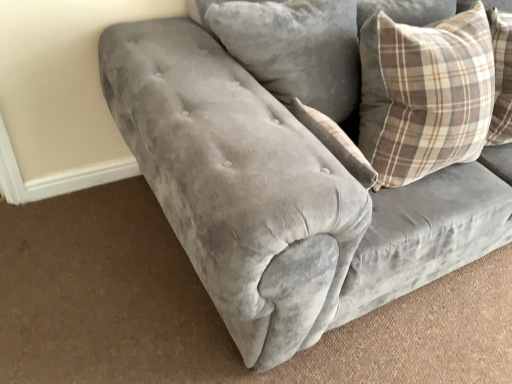
Question: Should I look upward or downward to see plaid fabric pillow at upper right, arranged as the 2th pillow when viewed from the right?

Choices:
 (A) down
 (B) up

Answer: (B)

Question: Is plaid fabric pillow at upper right, arranged as the 2th pillow when viewed from the right, located within plaid fabric pillow at upper right, the 1th pillow from the right?

Choices:
 (A) no
 (B) yes

Answer: (A)

Question: Is plaid fabric pillow at upper right, the 1th pillow from the right, shorter than plaid fabric pillow at upper right, arranged as the 2th pillow when viewed from the right?

Choices:
 (A) no
 (B) yes

Answer: (B)

Question: Does plaid fabric pillow at upper right, the 1th pillow from the right, come behind plaid fabric pillow at upper right, arranged as the 2th pillow when viewed from the right?

Choices:
 (A) yes
 (B) no

Answer: (B)

Question: From a real-world perspective, is plaid fabric pillow at upper right, which appears as the second pillow when viewed from the left, positioned over plaid fabric pillow at upper right, placed as the first pillow when sorted from left to right, based on gravity?

Choices:
 (A) no
 (B) yes

Answer: (A)

Question: Considering the relative sizes of plaid fabric pillow at upper right, which appears as the second pillow when viewed from the left, and plaid fabric pillow at upper right, placed as the first pillow when sorted from left to right, in the image provided, is plaid fabric pillow at upper right, which appears as the second pillow when viewed from the left, wider than plaid fabric pillow at upper right, placed as the first pillow when sorted from left to right,?

Choices:
 (A) no
 (B) yes

Answer: (A)

Question: Does plaid fabric pillow at upper right, the 1th pillow from the right, have a greater height compared to plaid fabric pillow at upper right, arranged as the 2th pillow when viewed from the right?

Choices:
 (A) yes
 (B) no

Answer: (B)

Question: Does plaid fabric pillow at upper right, placed as the first pillow when sorted from left to right, have a smaller size compared to plaid fabric pillow at upper right, the 1th pillow from the right?

Choices:
 (A) yes
 (B) no

Answer: (B)

Question: Is plaid fabric pillow at upper right, placed as the first pillow when sorted from left to right, bigger than plaid fabric pillow at upper right, which appears as the second pillow when viewed from the left?

Choices:
 (A) yes
 (B) no

Answer: (A)

Question: Considering the relative positions of plaid fabric pillow at upper right, placed as the first pillow when sorted from left to right, and plaid fabric pillow at upper right, which appears as the second pillow when viewed from the left, in the image provided, is plaid fabric pillow at upper right, placed as the first pillow when sorted from left to right, in front of plaid fabric pillow at upper right, which appears as the second pillow when viewed from the left,?

Choices:
 (A) no
 (B) yes

Answer: (A)

Question: From a real-world perspective, does plaid fabric pillow at upper right, arranged as the 2th pillow when viewed from the right, stand above plaid fabric pillow at upper right, the 1th pillow from the right?

Choices:
 (A) yes
 (B) no

Answer: (A)

Question: Is plaid fabric pillow at upper right, arranged as the 2th pillow when viewed from the right, behind plaid fabric pillow at upper right, the 1th pillow from the right?

Choices:
 (A) yes
 (B) no

Answer: (A)

Question: Is plaid fabric pillow at upper right, placed as the first pillow when sorted from left to right, thinner than plaid fabric pillow at upper right, the 1th pillow from the right?

Choices:
 (A) no
 (B) yes

Answer: (A)

Question: Choose the correct answer: Is plaid fabric pillow at upper right, the 1th pillow from the right, inside plaid fabric pillow at upper right, placed as the first pillow when sorted from left to right, or outside it?

Choices:
 (A) inside
 (B) outside

Answer: (B)